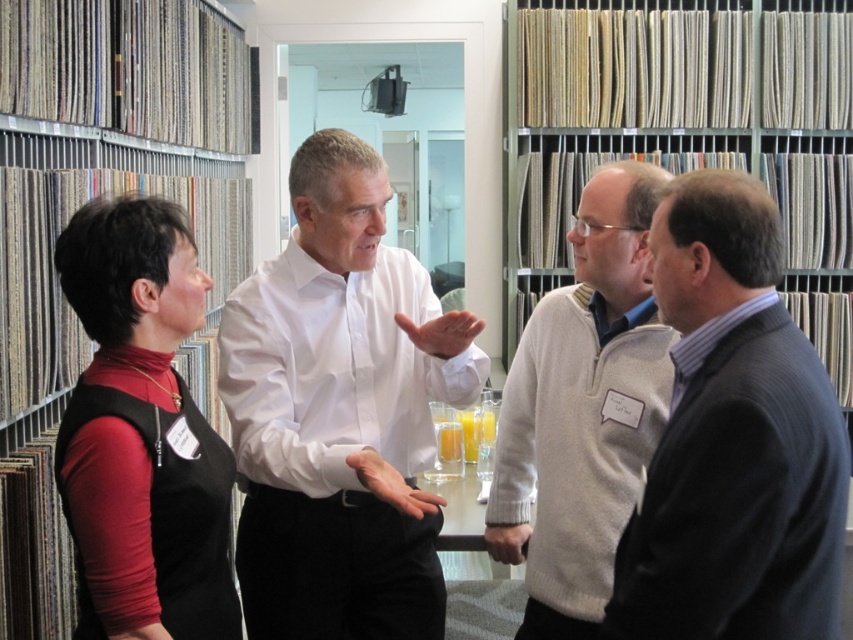
Question: Does white smooth shirt at center appear on the right side of gray wool sweater at right?

Choices:
 (A) yes
 (B) no

Answer: (B)

Question: Which point is closer to the camera?

Choices:
 (A) metallic gray bookshelf at left
 (B) white textured sweater at center
 (C) white smooth shirt at center
 (D) gray wool sweater at right

Answer: (D)

Question: Among these objects, which one is nearest to the camera?

Choices:
 (A) white textured sweater at center
 (B) white smooth shirt at center

Answer: (B)

Question: Does white smooth shirt at center have a larger size compared to gray wool sweater at right?

Choices:
 (A) yes
 (B) no

Answer: (A)

Question: Is gray wool sweater at right smaller than metallic gray bookshelf at left?

Choices:
 (A) no
 (B) yes

Answer: (B)

Question: Which point is closer to the camera?

Choices:
 (A) (604, 589)
 (B) (85, 192)

Answer: (A)